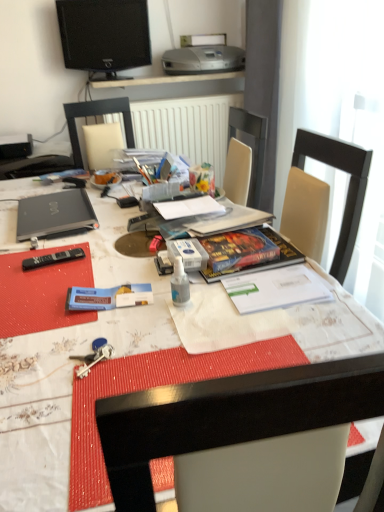
Question: From a real-world perspective, is black glossy television at upper center located higher than black matte laptop at left?

Choices:
 (A) no
 (B) yes

Answer: (B)

Question: Is black glossy television at upper center far from black matte laptop at left?

Choices:
 (A) yes
 (B) no

Answer: (A)

Question: Is black glossy television at upper center shorter than black matte laptop at left?

Choices:
 (A) no
 (B) yes

Answer: (A)

Question: Is black matte laptop at left a part of black glossy television at upper center?

Choices:
 (A) no
 (B) yes

Answer: (A)

Question: From the image's perspective, is black glossy television at upper center under black matte laptop at left?

Choices:
 (A) yes
 (B) no

Answer: (B)

Question: Can you confirm if black glossy television at upper center is wider than black matte laptop at left?

Choices:
 (A) no
 (B) yes

Answer: (A)

Question: Considering the relative positions of transparent plastic spray bottle at center and white glossy desk at center in the image provided, is transparent plastic spray bottle at center to the left of white glossy desk at center from the viewer's perspective?

Choices:
 (A) no
 (B) yes

Answer: (A)

Question: From a real-world perspective, is transparent plastic spray bottle at center located higher than white glossy desk at center?

Choices:
 (A) no
 (B) yes

Answer: (B)

Question: From the image's perspective, would you say transparent plastic spray bottle at center is positioned over white glossy desk at center?

Choices:
 (A) yes
 (B) no

Answer: (A)

Question: Is transparent plastic spray bottle at center located outside white glossy desk at center?

Choices:
 (A) yes
 (B) no

Answer: (A)

Question: Does transparent plastic spray bottle at center have a greater width compared to white glossy desk at center?

Choices:
 (A) yes
 (B) no

Answer: (B)

Question: From a real-world perspective, is transparent plastic spray bottle at center under white glossy desk at center?

Choices:
 (A) yes
 (B) no

Answer: (B)

Question: Is there a large distance between black matte laptop at left and silver metallic printer at upper center?

Choices:
 (A) no
 (B) yes

Answer: (B)